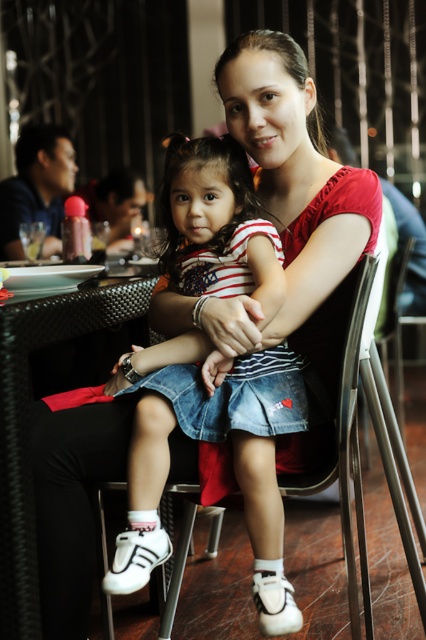
Can you confirm if black woven table at lower left is positioned below metallic silver chair at center?

No, black woven table at lower left is not below metallic silver chair at center.

Between black woven table at lower left and metallic silver chair at center, which one is positioned higher?

black woven table at lower left is higher up.

Which is behind, point (2, 348) or point (333, 452)?

The point (333, 452) is behind.

You are a GUI agent. You are given a task and a screenshot of the screen. Output one action in this format:
    pyautogui.click(x=<x>, y=<y>)
    Task: Click on the black woven table at lower left
    The image size is (426, 640).
    Given the screenshot: What is the action you would take?
    pyautogui.click(x=28, y=426)